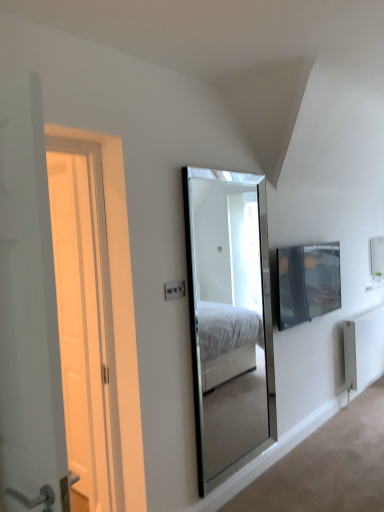
What do you see at coordinates (364, 347) in the screenshot?
I see `white metallic radiator at lower right` at bounding box center [364, 347].

Describe the element at coordinates (174, 290) in the screenshot. I see `white plastic electric outlet at center` at that location.

The width and height of the screenshot is (384, 512). In order to click on matte black tv at right in this screenshot , I will do `click(307, 282)`.

Consider the image. Which object is wider, clear glass mirror at center or white wooden door at left?

Wider between the two is white wooden door at left.

Which of these two, clear glass mirror at center or white wooden door at left, is bigger?

Bigger between the two is clear glass mirror at center.

From a real-world perspective, is clear glass mirror at center below white wooden door at left?

Yes, from a real-world perspective, clear glass mirror at center is beneath white wooden door at left.

Is clear glass mirror at center outside of white wooden door at left?

That's correct, clear glass mirror at center is outside of white wooden door at left.

Considering the points (5, 94) and (296, 283), which point is in front, point (5, 94) or point (296, 283)?

Positioned in front is point (5, 94).

From the image's perspective, is white wooden door at left positioned above or below matte black tv at right?

white wooden door at left is below matte black tv at right.

From a real-world perspective, is white wooden door at left positioned above or below matte black tv at right?

white wooden door at left is situated higher than matte black tv at right in the real world.

Is white wooden door at left further to the viewer compared to matte black tv at right?

No, the depth of white wooden door at left is less than that of matte black tv at right.

Considering the points (316, 254) and (242, 342), which point is in front, point (316, 254) or point (242, 342)?

The point (316, 254) is closer to the camera.

Considering the sizes of objects matte black tv at right and clear glass mirror at center in the image provided, who is taller, matte black tv at right or clear glass mirror at center?

clear glass mirror at center.

The height and width of the screenshot is (512, 384). What are the coordinates of `television that is behind the clear glass mirror at center` in the screenshot? It's located at (307, 282).

Between matte black tv at right and clear glass mirror at center, which one has larger size?

Bigger between the two is clear glass mirror at center.

How much distance is there between white wooden door at left and white metallic radiator at lower right?

The distance of white wooden door at left from white metallic radiator at lower right is 10.25 feet.

You are a GUI agent. You are given a task and a screenshot of the screen. Output one action in this format:
    pyautogui.click(x=<x>, y=<y>)
    Task: Click on the door on the left of the white metallic radiator at lower right
    
    Given the screenshot: What is the action you would take?
    pyautogui.click(x=28, y=313)

Could you tell me if white wooden door at left is turned towards white metallic radiator at lower right?

Yes.

Is white wooden door at left not close to white metallic radiator at lower right?

Indeed, white wooden door at left is not near white metallic radiator at lower right.

Considering the relative sizes of white metallic radiator at lower right and matte black tv at right in the image provided, is white metallic radiator at lower right smaller than matte black tv at right?

No.

Is white metallic radiator at lower right not inside matte black tv at right?

Indeed, white metallic radiator at lower right is completely outside matte black tv at right.

From the image's perspective, is white metallic radiator at lower right over matte black tv at right?

Incorrect, from the image's perspective, white metallic radiator at lower right is lower than matte black tv at right.

Is white metallic radiator at lower right positioned far away from matte black tv at right?

No.

Could you tell me if matte black tv at right is turned towards white metallic radiator at lower right?

No, matte black tv at right does not turn towards white metallic radiator at lower right.

Consider the image. Is matte black tv at right taller or shorter than white metallic radiator at lower right?

In the image, matte black tv at right appears to be shorter than white metallic radiator at lower right.

From a real-world perspective, relative to white metallic radiator at lower right, is matte black tv at right vertically above or below?

matte black tv at right is above white metallic radiator at lower right.

Which is more to the right, clear glass mirror at center or matte black tv at right?

Positioned to the right is matte black tv at right.

How different are the orientations of clear glass mirror at center and matte black tv at right in degrees?

The facing directions of clear glass mirror at center and matte black tv at right are 1.1 degrees apart.

Which is less distant, (254, 424) or (298, 295)?

Point (254, 424) is positioned farther from the camera compared to point (298, 295).

Is clear glass mirror at center touching matte black tv at right?

No, clear glass mirror at center is not making contact with matte black tv at right.

Identify the location of mirror below the white wooden door at left (from a real-world perspective). (228, 316).

Image resolution: width=384 pixels, height=512 pixels. I want to click on door below the matte black tv at right (from the image's perspective), so click(x=28, y=313).

Estimate the real-world distances between objects in this image. Which object is closer to white metallic radiator at lower right, matte black tv at right or white wooden door at left?

matte black tv at right.

Estimate the real-world distances between objects in this image. Which object is further from matte black tv at right, white metallic radiator at lower right or white plastic electric outlet at center?

Among the two, white plastic electric outlet at center is located further to matte black tv at right.

When comparing their distances from white metallic radiator at lower right, does clear glass mirror at center or white plastic electric outlet at center seem closer?

clear glass mirror at center is closer to white metallic radiator at lower right.

When comparing their distances from matte black tv at right, does white plastic electric outlet at center or clear glass mirror at center seem closer?

clear glass mirror at center is closer to matte black tv at right.

When comparing their distances from white plastic electric outlet at center, does clear glass mirror at center or white metallic radiator at lower right seem closer?

clear glass mirror at center is closer to white plastic electric outlet at center.

Considering their positions, is clear glass mirror at center positioned further to white wooden door at left than white plastic electric outlet at center?

Among the two, clear glass mirror at center is located further to white wooden door at left.

Looking at the image, which one is located closer to white wooden door at left, white metallic radiator at lower right or white plastic electric outlet at center?

Among the two, white plastic electric outlet at center is located nearer to white wooden door at left.

Looking at the image, which one is located further to clear glass mirror at center, white wooden door at left or white metallic radiator at lower right?

The object further to clear glass mirror at center is white wooden door at left.

Locate an element on the screen. electric outlet between white wooden door at left and clear glass mirror at center along the z-axis is located at coordinates (174, 290).

This screenshot has height=512, width=384. I want to click on mirror located between white plastic electric outlet at center and white metallic radiator at lower right in the left-right direction, so point(228,316).

You are a GUI agent. You are given a task and a screenshot of the screen. Output one action in this format:
    pyautogui.click(x=<x>, y=<y>)
    Task: Click on the television between white wooden door at left and white metallic radiator at lower right in the front-back direction
    The image size is (384, 512).
    Given the screenshot: What is the action you would take?
    pyautogui.click(x=307, y=282)

Find the location of a particular element. This screenshot has height=512, width=384. mirror located between white plastic electric outlet at center and matte black tv at right in the left-right direction is located at coordinates (228, 316).